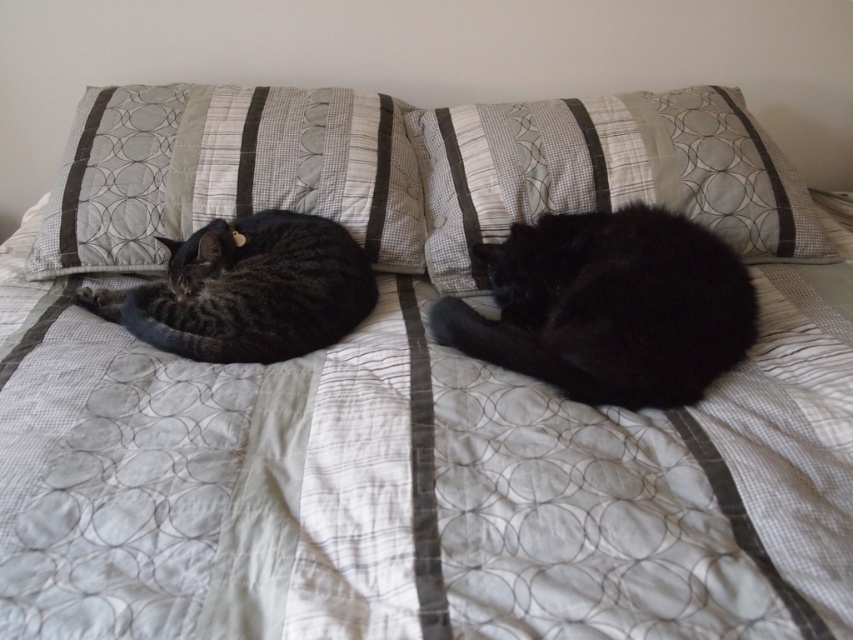
Question: Which of the following is the closest to the observer?

Choices:
 (A) coord(532,124)
 (B) coord(274,180)
 (C) coord(636,332)

Answer: (C)

Question: Which point is farther from the camera taking this photo?

Choices:
 (A) (601, 368)
 (B) (170, 285)
 (C) (389, 252)

Answer: (C)

Question: Can you confirm if textured fabric pillow at center is thinner than gray striped cat at left?

Choices:
 (A) no
 (B) yes

Answer: (A)

Question: Is black silky cat at center above gray striped cat at left?

Choices:
 (A) no
 (B) yes

Answer: (A)

Question: Which of the following is the closest to the observer?

Choices:
 (A) (819, 234)
 (B) (189, 196)

Answer: (B)

Question: Can you confirm if textured fabric pillow at upper left is positioned below black silky cat at center?

Choices:
 (A) yes
 (B) no

Answer: (B)